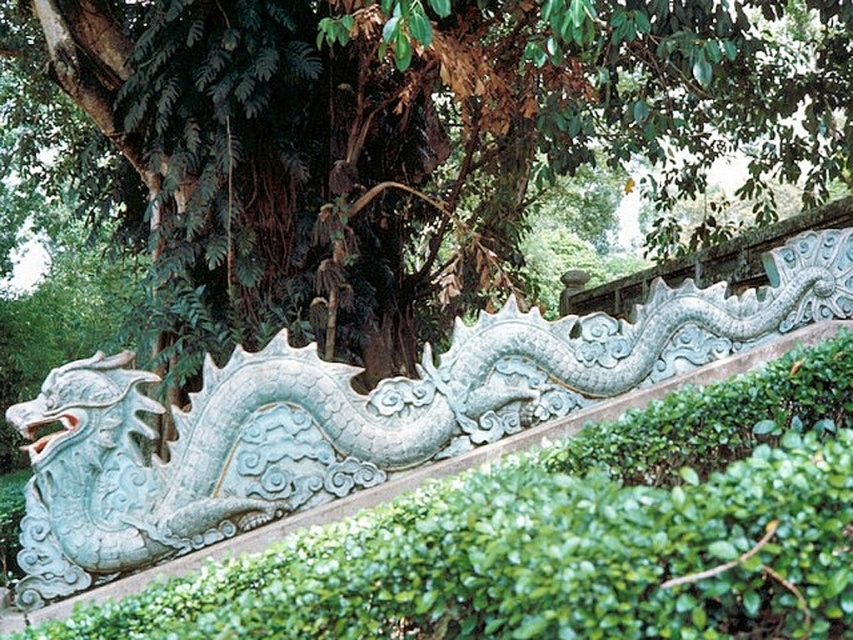
You are a gardener planning to water the green leafy tree at center and the light blue stone dragon at center. Since the tree is smaller, will you need to adjust the water pressure when moving from watering the dragon to the tree?

The green leafy tree at center is smaller than the light blue stone dragon at center, so you should reduce the water pressure when moving from watering the dragon to the tree to avoid overwatering the smaller plant.

What are the coordinates of the green leafy tree at center in the image?

The coordinates of the green leafy tree at center are at point [403,138].